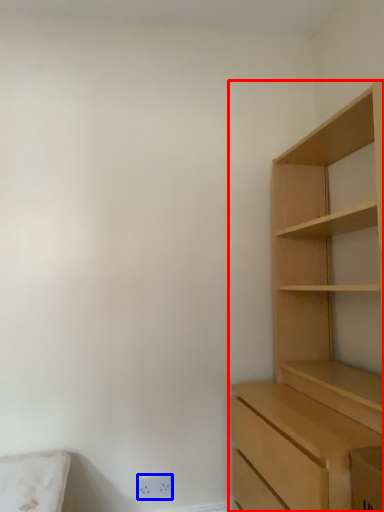
Question: Which of the following is the farthest to the observer, cupboard (highlighted by a red box) or electric outlet (highlighted by a blue box)?

Choices:
 (A) cupboard
 (B) electric outlet

Answer: (B)